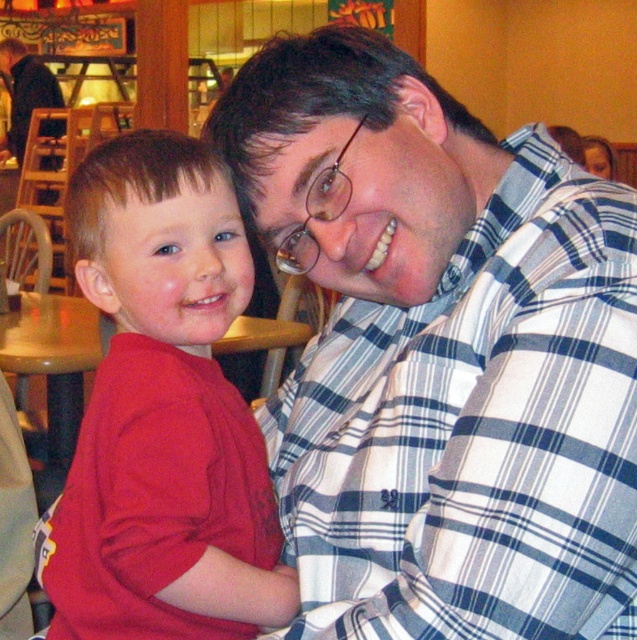
Can you confirm if white plaid shirt at upper right is positioned to the right of matte red shirt at left?

Correct, you'll find white plaid shirt at upper right to the right of matte red shirt at left.

Does white plaid shirt at upper right appear under matte red shirt at left?

No.

Describe the element at coordinates (475, 429) in the screenshot. I see `white plaid shirt at upper right` at that location.

In order to click on white plaid shirt at upper right in this screenshot , I will do `click(475, 429)`.